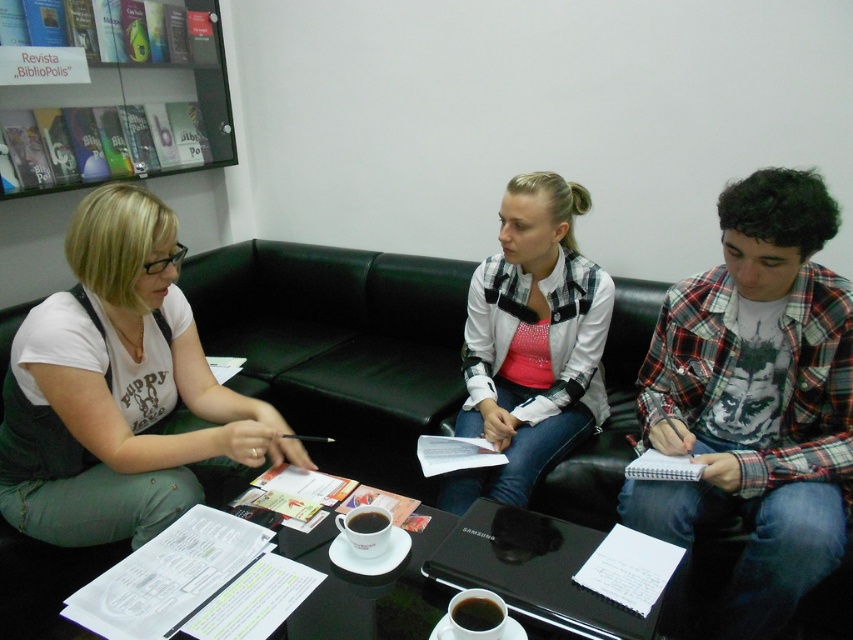
Is black glossy cup at center taller than black matte cup at center?

Yes.

Is black glossy cup at center positioned in front of black matte cup at center?

Yes, it is in front of black matte cup at center.

Which is in front, point (460, 628) or point (369, 522)?

Point (460, 628)

Locate an element on the screen. black glossy cup at center is located at coordinates (476, 612).

Can you confirm if white matte shirt at center is smaller than black glossy table at lower center?

No, white matte shirt at center is not smaller than black glossy table at lower center.

Which is behind, point (132, 392) or point (485, 556)?

Point (132, 392)

Image resolution: width=853 pixels, height=640 pixels. In order to click on white matte shirt at center in this screenshot , I will do `click(119, 388)`.

Can you confirm if white matte shirt at center is positioned above black matte cup at center?

Yes.

Find the location of a particular element. The height and width of the screenshot is (640, 853). white matte shirt at center is located at coordinates (119, 388).

At what (x,y) coordinates should I click in order to perform the action: click on white matte shirt at center. Please return your answer as a coordinate pair (x, y). The image size is (853, 640). Looking at the image, I should click on (119, 388).